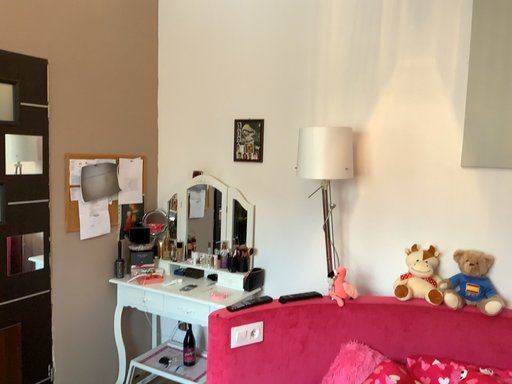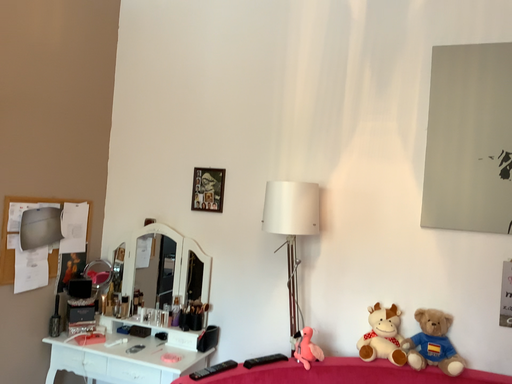
Question: How did the camera likely rotate when shooting the video?

Choices:
 (A) rotated right
 (B) rotated left

Answer: (A)